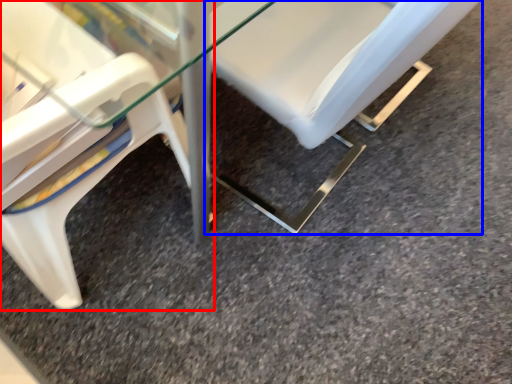
Question: Which object appears farthest to the camera in this image, chair (highlighted by a red box) or chair (highlighted by a blue box)?

Choices:
 (A) chair
 (B) chair

Answer: (B)